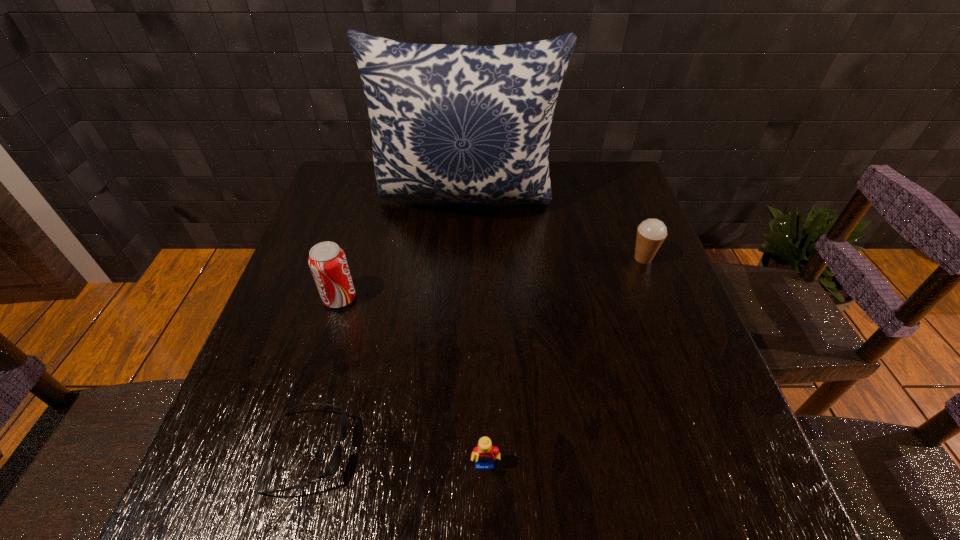
This screenshot has height=540, width=960. I want to click on vacant region that satisfies the following two spatial constraints: 1. on the front side of the rightmost object; 2. on the logo side of the soda can, so click(x=659, y=298).

Where is `vacant point that satisfies the following two spatial constraints: 1. on the front side of the fourth nearest object; 2. on the front-facing side of the sunglasses`? vacant point that satisfies the following two spatial constraints: 1. on the front side of the fourth nearest object; 2. on the front-facing side of the sunglasses is located at coordinates (718, 452).